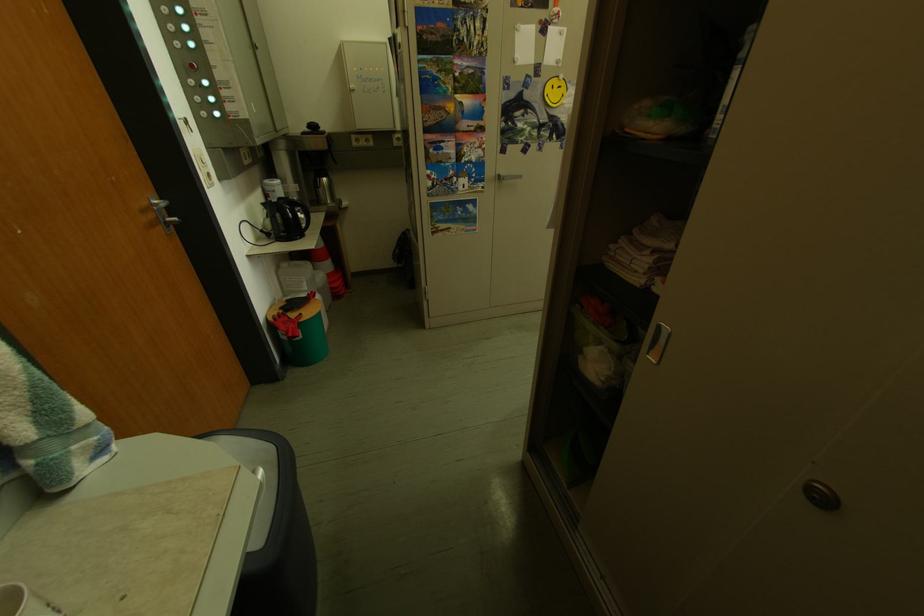
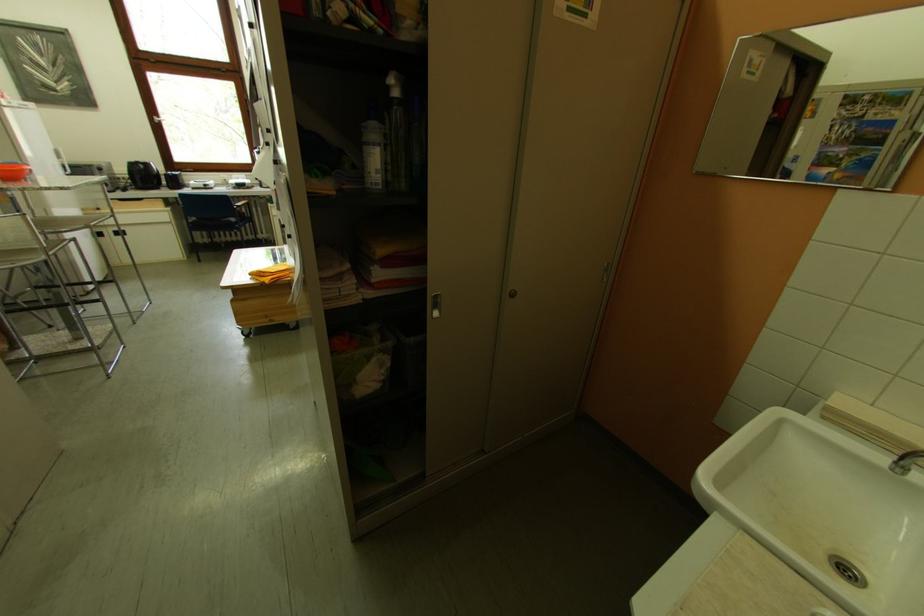
How did the camera likely rotate?

The camera rotated toward right-down.